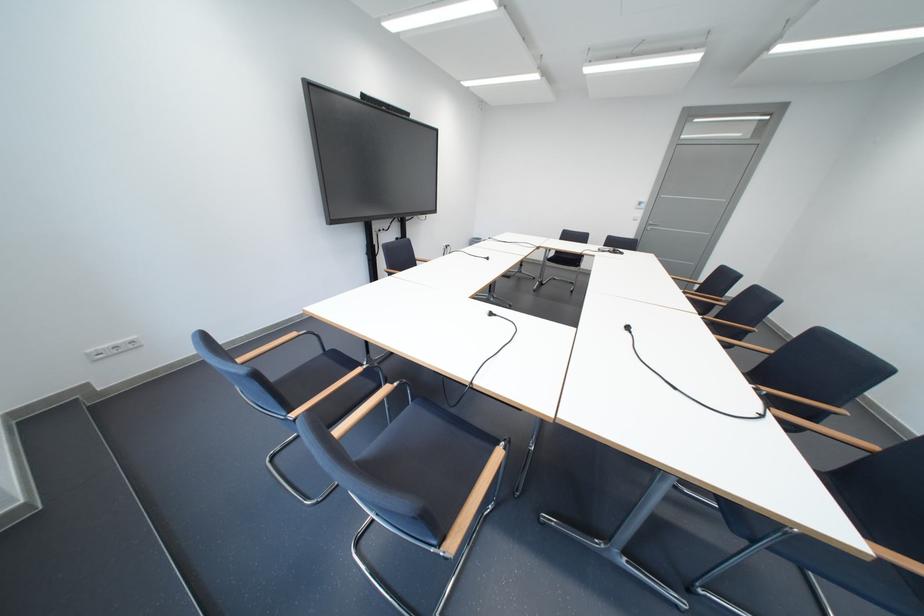
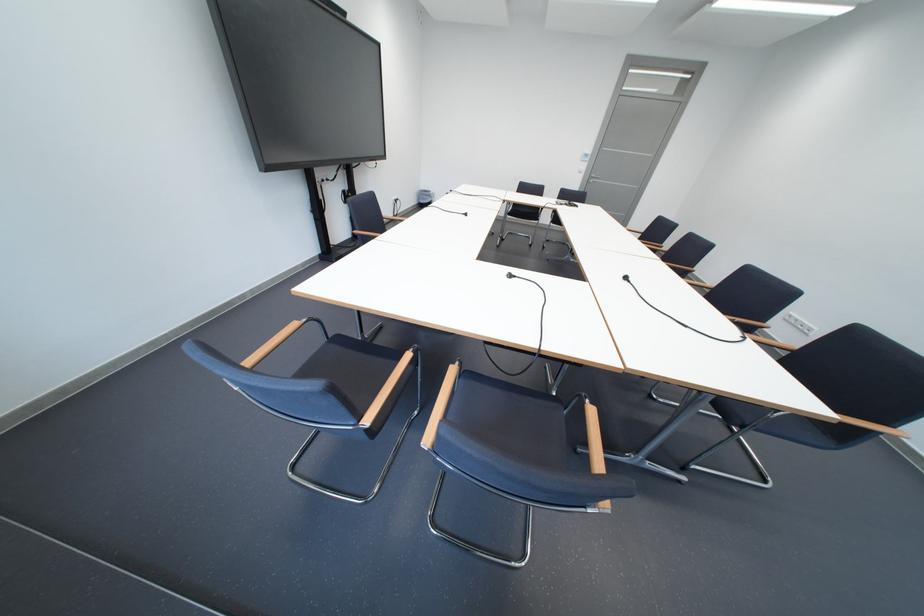
Find the pixel in the second image that matches [398,391] in the first image.

(465, 371)